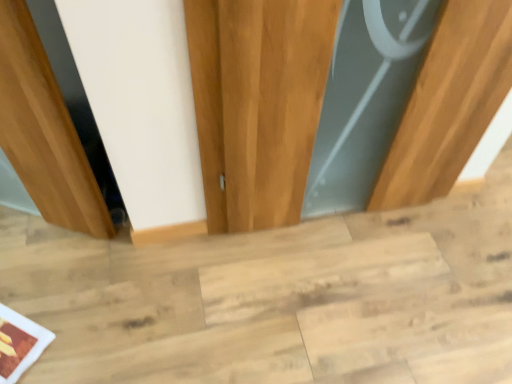
Locate an element on the screen. This screenshot has height=384, width=512. free space to the left of wooden door at center is located at coordinates (246, 254).